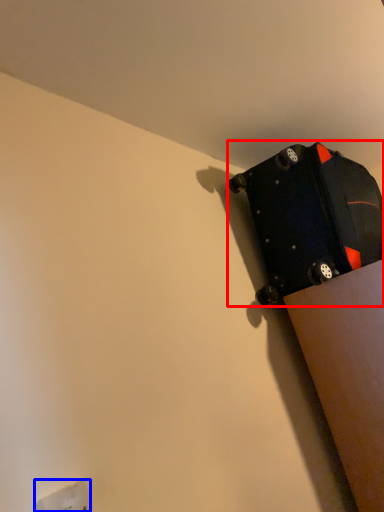
Question: Which object appears farthest to the camera in this image, luggage and bags (highlighted by a red box) or electric outlet (highlighted by a blue box)?

Choices:
 (A) luggage and bags
 (B) electric outlet

Answer: (A)